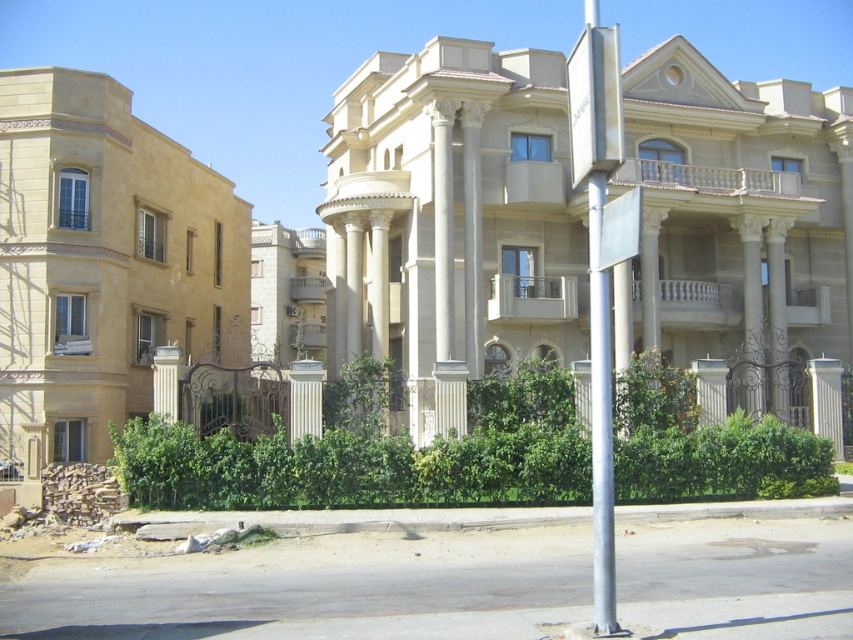
Is green leafy hedge at center thinner than white plastic sign at center?

Incorrect, green leafy hedge at center's width is not less than white plastic sign at center's.

Consider the image. Which is below, green leafy hedge at center or white plastic sign at center?

green leafy hedge at center

I want to click on green leafy hedge at center, so click(370, 458).

Between white plastic sign at center and white smooth pillar at center, which one appears on the left side from the viewer's perspective?

white smooth pillar at center is more to the left.

Between point (608, 253) and point (306, 380), which one is positioned behind?

The point (306, 380) is behind.

Image resolution: width=853 pixels, height=640 pixels. Identify the location of white plastic sign at center. (619, 228).

Is green leafy hedge at center to the right of white smooth pillar at center from the viewer's perspective?

Yes, green leafy hedge at center is to the right of white smooth pillar at center.

This screenshot has height=640, width=853. Find the location of `green leafy hedge at center`. green leafy hedge at center is located at coordinates (370, 458).

Which is in front, point (338, 442) or point (302, 378)?

Point (338, 442)

The image size is (853, 640). Find the location of `green leafy hedge at center`. green leafy hedge at center is located at coordinates (370, 458).